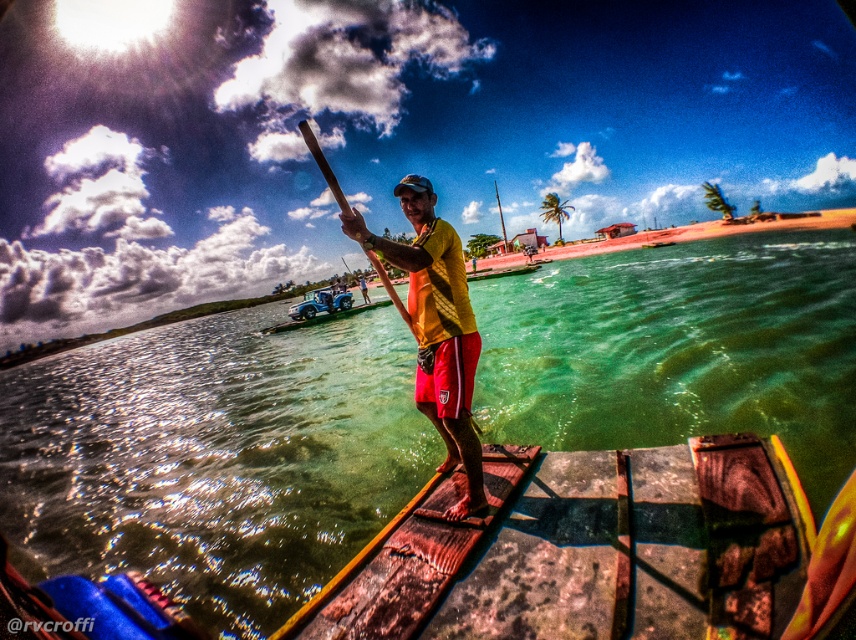
Between green translucent water at center and yellow matte shirt at center, which one is positioned lower?

yellow matte shirt at center is lower down.

At what (x,y) coordinates should I click in order to perform the action: click on green translucent water at center. Please return your answer as a coordinate pair (x, y). The height and width of the screenshot is (640, 856). Looking at the image, I should click on (214, 458).

Between green translucent water at center and wooden paddle at center, which one appears on the right side from the viewer's perspective?

green translucent water at center is more to the right.

Does green translucent water at center appear on the left side of wooden paddle at center?

No, green translucent water at center is not to the left of wooden paddle at center.

I want to click on green translucent water at center, so click(214, 458).

This screenshot has height=640, width=856. What do you see at coordinates (586, 548) in the screenshot?
I see `wooden planks at center` at bounding box center [586, 548].

Does wooden planks at center appear on the left side of yellow matte shirt at center?

In fact, wooden planks at center is to the right of yellow matte shirt at center.

Measure the distance between point [492,486] and camera.

The distance of point [492,486] from camera is 4.14 meters.

Find the location of a particular element. The height and width of the screenshot is (640, 856). wooden planks at center is located at coordinates (586, 548).